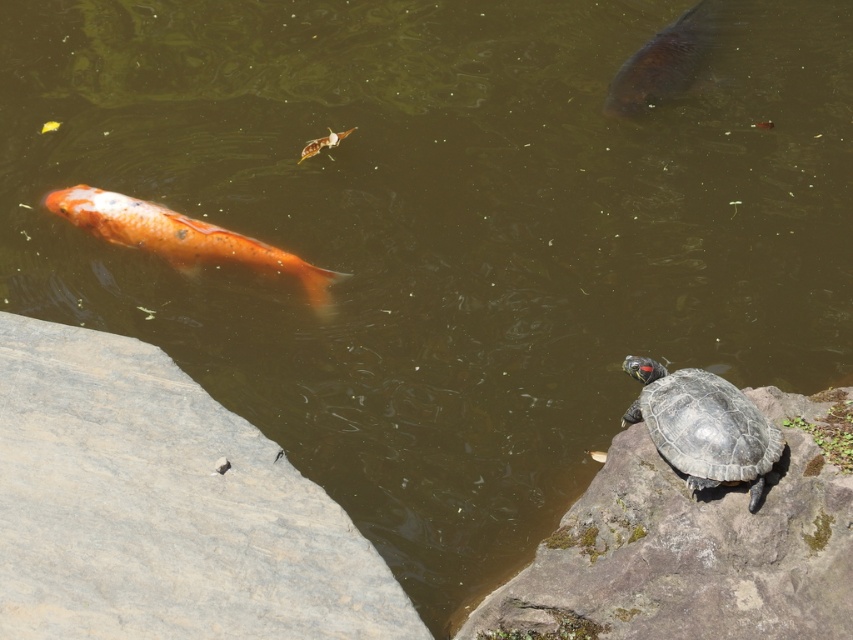
You are standing at the edge of the pond and want to place two markers to indicate the locations of two fish. The first marker should be placed at point [62,371] and the second at point [126,208]. Which marker will appear closer to you when viewed from your current position?

The marker at point [62,371] will appear closer to you because it is closer to the viewer than point [126,208].